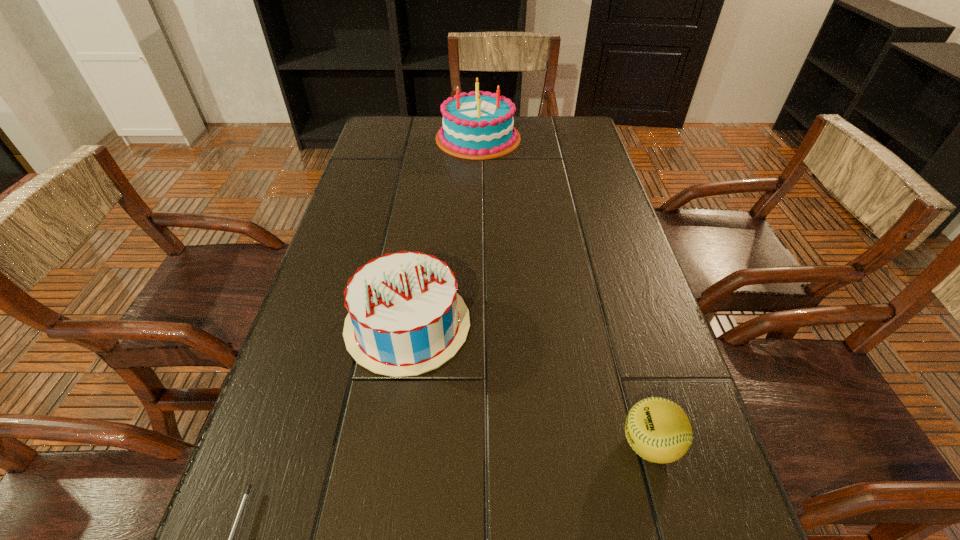
Where is `free space located 0.170m on the logo side of the rightmost object`? This screenshot has height=540, width=960. free space located 0.170m on the logo side of the rightmost object is located at coordinates (517, 444).

Find the location of a particular element. Image resolution: width=960 pixels, height=540 pixels. object positioned at the far edge is located at coordinates (479, 125).

What are the coordinates of `object at the left edge` in the screenshot? It's located at (405, 318).

Find the location of `object that is at the right edge`. object that is at the right edge is located at coordinates (657, 429).

Where is `free region at the left edge`? free region at the left edge is located at coordinates (333, 249).

In the image, there is a desktop. What are the coordinates of `free space at the right edge` in the screenshot? It's located at (612, 198).

What are the coordinates of `free space at the far left corner of the desktop` in the screenshot? It's located at (370, 138).

Locate an element on the screen. The image size is (960, 540). free space between the second nearest object and the third shortest object is located at coordinates (529, 384).

I want to click on empty space between the third nearest object and the farthest object, so click(x=443, y=232).

Where is `vacant point located between the tallest object and the second farthest object`? Image resolution: width=960 pixels, height=540 pixels. vacant point located between the tallest object and the second farthest object is located at coordinates (443, 232).